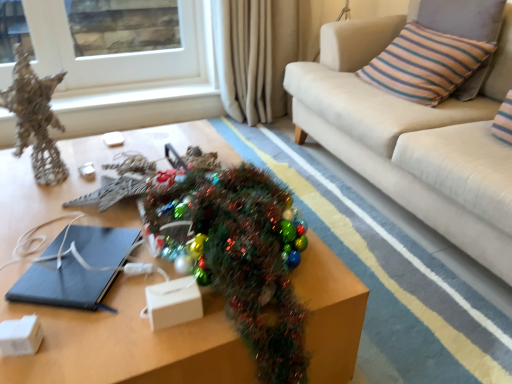
The image size is (512, 384). Find the location of `vacant area that is situated to the right of matte black notebook at center`. vacant area that is situated to the right of matte black notebook at center is located at coordinates (140, 289).